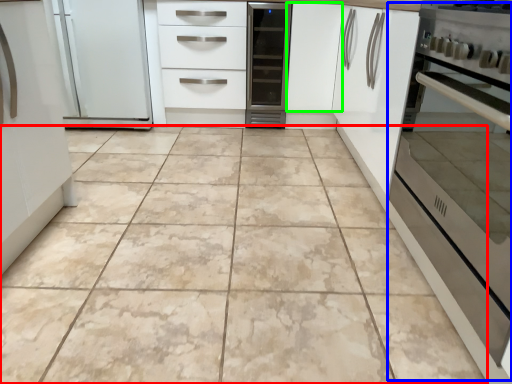
Question: Which object is the farthest from ceramic tile (highlighted by a red box)? Choose among these: oven (highlighted by a blue box) or cabinetry (highlighted by a green box).

Choices:
 (A) oven
 (B) cabinetry

Answer: (B)